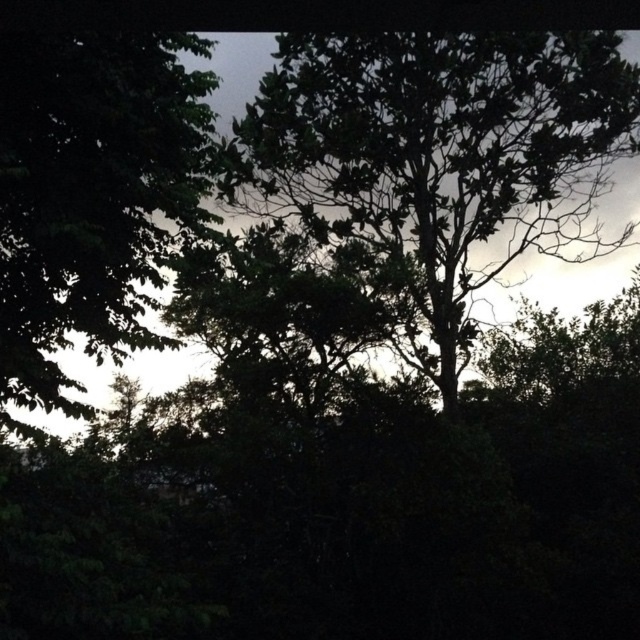
Can you confirm if dark green leafy tree at center is thinner than green leafy tree at left?

Yes.

Which is behind, point (284, 115) or point (10, 189)?

The point (284, 115) is behind.

Which is in front, point (444, 134) or point (90, 323)?

Point (90, 323) is more forward.

I want to click on dark green leafy tree at center, so click(x=440, y=157).